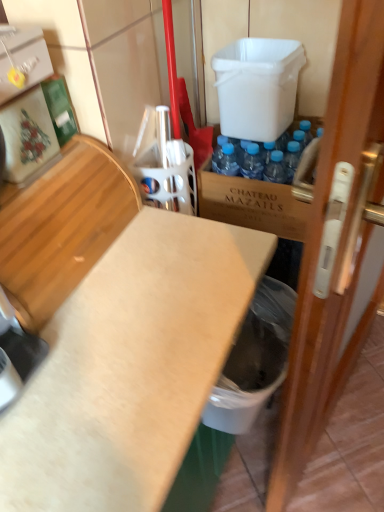
Describe the element at coordinates (251, 204) in the screenshot. This screenshot has width=384, height=512. I see `brown wooden crate at center` at that location.

This screenshot has width=384, height=512. I want to click on white matte countertop at center, so click(130, 366).

What do you see at coordinates (130, 366) in the screenshot?
I see `white matte countertop at center` at bounding box center [130, 366].

The image size is (384, 512). What do you see at coordinates (336, 247) in the screenshot? I see `wooden door at right` at bounding box center [336, 247].

This screenshot has width=384, height=512. Describe the element at coordinates (62, 227) in the screenshot. I see `light brown wood at left` at that location.

Where is `brown wooden crate at center`? brown wooden crate at center is located at coordinates (251, 204).

Between wooden door at right and white matte countertop at center, which one has more height?

wooden door at right.

From a real-world perspective, is wooden door at right under white matte countertop at center?

No, from a real-world perspective, wooden door at right is not beneath white matte countertop at center.

This screenshot has height=512, width=384. I want to click on door on the right of white matte countertop at center, so click(x=336, y=247).

Is wooden door at right in contact with white matte countertop at center?

No, wooden door at right is not making contact with white matte countertop at center.

This screenshot has width=384, height=512. Find the location of `water cooler above the light brown wood at left (from the image's perspective)`. water cooler above the light brown wood at left (from the image's perspective) is located at coordinates (257, 86).

From the picture: Can you confirm if light brown wood at left is shorter than white plastic container at upper center?

Correct, light brown wood at left is not as tall as white plastic container at upper center.

Would you say light brown wood at left is to the left or to the right of white plastic container at upper center in the picture?

light brown wood at left is to the left of white plastic container at upper center.

Are white matte countertop at center and white plastic container at upper center making contact?

No, white matte countertop at center is not making contact with white plastic container at upper center.

In the scene shown: Between white matte countertop at center and white plastic container at upper center, which one is positioned behind?

white plastic container at upper center is further away from the camera.

Looking at this image, between white matte countertop at center and white plastic container at upper center, which one has larger size?

Bigger between the two is white matte countertop at center.

From a real-world perspective, who is located higher, white matte countertop at center or white plastic container at upper center?

white plastic container at upper center.

Is white plastic trash can at lower right bigger or smaller than brown wooden crate at center?

white plastic trash can at lower right is smaller than brown wooden crate at center.

Is the depth of white plastic trash can at lower right greater than that of brown wooden crate at center?

No, it is in front of brown wooden crate at center.

In order to click on cardboard box above the white plastic trash can at lower right (from a real-world perspective) in this screenshot , I will do tap(251, 204).

How different are the orientations of white plastic trash can at lower right and brown wooden crate at center in degrees?

There is a 87.3-degree angle between the facing directions of white plastic trash can at lower right and brown wooden crate at center.

This screenshot has height=512, width=384. Find the location of `water cooler that appears on the left of brown wooden crate at center`. water cooler that appears on the left of brown wooden crate at center is located at coordinates tap(257, 86).

From a real-world perspective, is white plastic container at upper center positioned above or below brown wooden crate at center?

Clearly, from a real-world perspective, white plastic container at upper center is above brown wooden crate at center.

Does white plastic container at upper center have a smaller size compared to brown wooden crate at center?

Indeed, white plastic container at upper center has a smaller size compared to brown wooden crate at center.

Can we say white plastic container at upper center lies outside brown wooden crate at center?

Absolutely, white plastic container at upper center is external to brown wooden crate at center.

Does point (265, 86) appear closer or farther from the camera than point (231, 426)?

Point (265, 86) is farther from the camera than point (231, 426).

From a real-world perspective, between white plastic container at upper center and white plastic trash can at lower right, who is vertically higher?

white plastic container at upper center.

How distant is white plastic container at upper center from white plastic trash can at lower right?

white plastic container at upper center and white plastic trash can at lower right are 55.79 centimeters apart from each other.

Looking at this image, in the image, is white plastic container at upper center positioned in front of or behind white plastic trash can at lower right?

In the image, white plastic container at upper center appears behind white plastic trash can at lower right.

In terms of size, does brown wooden crate at center appear bigger or smaller than wooden door at right?

Considering their sizes, brown wooden crate at center takes up less space than wooden door at right.

Who is shorter, brown wooden crate at center or wooden door at right?

brown wooden crate at center is shorter.

Does brown wooden crate at center turn towards wooden door at right?

No, brown wooden crate at center does not turn towards wooden door at right.

From the image's perspective, which one is positioned lower, brown wooden crate at center or wooden door at right?

wooden door at right.

You are a GUI agent. You are given a task and a screenshot of the screen. Output one action in this format:
    pyautogui.click(x=<x>, y=<y>)
    Task: Click on the door above the white matte countertop at center (from a real-world perspective)
    
    Given the screenshot: What is the action you would take?
    pyautogui.click(x=336, y=247)

Image resolution: width=384 pixels, height=512 pixels. Find the location of `wood located below the white plastic container at upper center (from the image's perspective)`. wood located below the white plastic container at upper center (from the image's perspective) is located at coordinates (62, 227).

Estimate the real-world distances between objects in this image. Which object is closer to white plastic trash can at lower right, light brown wood at left or wooden door at right?

wooden door at right lies closer to white plastic trash can at lower right than the other object.

From the picture: Which object lies further to the anchor point white matte countertop at center, white plastic container at upper center or white plastic trash can at lower right?

The object further to white matte countertop at center is white plastic container at upper center.

Based on their spatial positions, is brown wooden crate at center or white matte countertop at center further from white plastic trash can at lower right?

brown wooden crate at center.

Estimate the real-world distances between objects in this image. Which object is closer to white plastic trash can at lower right, wooden door at right or light brown wood at left?

The object closer to white plastic trash can at lower right is wooden door at right.

When comparing their distances from white plastic trash can at lower right, does white plastic container at upper center or wooden door at right seem closer?

The object closer to white plastic trash can at lower right is wooden door at right.

Considering their positions, is wooden door at right positioned further to white plastic container at upper center than white plastic trash can at lower right?

wooden door at right.

In the scene shown: From the image, which object appears to be farther from light brown wood at left, white matte countertop at center or white plastic trash can at lower right?

white plastic trash can at lower right lies further to light brown wood at left than the other object.

Based on their spatial positions, is white matte countertop at center or wooden door at right closer to brown wooden crate at center?

Based on the image, white matte countertop at center appears to be nearer to brown wooden crate at center.

Identify the location of cardboard box between white plastic container at upper center and white plastic trash can at lower right in the vertical direction. This screenshot has height=512, width=384. (251, 204).

Locate an element on the screen. garbage between brown wooden crate at center and white matte countertop at center in the up-down direction is located at coordinates [x=254, y=360].

Identify the location of garbage between white plastic container at upper center and white matte countertop at center from top to bottom. The image size is (384, 512). (254, 360).

Locate an element on the screen. The width and height of the screenshot is (384, 512). water cooler situated between light brown wood at left and brown wooden crate at center from left to right is located at coordinates (257, 86).